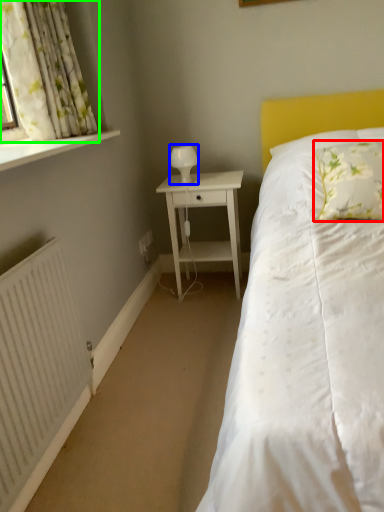
Question: Considering the real-world distances, which object is farthest from pillow (highlighted by a red box)? table lamp (highlighted by a blue box) or curtain (highlighted by a green box)?

Choices:
 (A) table lamp
 (B) curtain

Answer: (B)